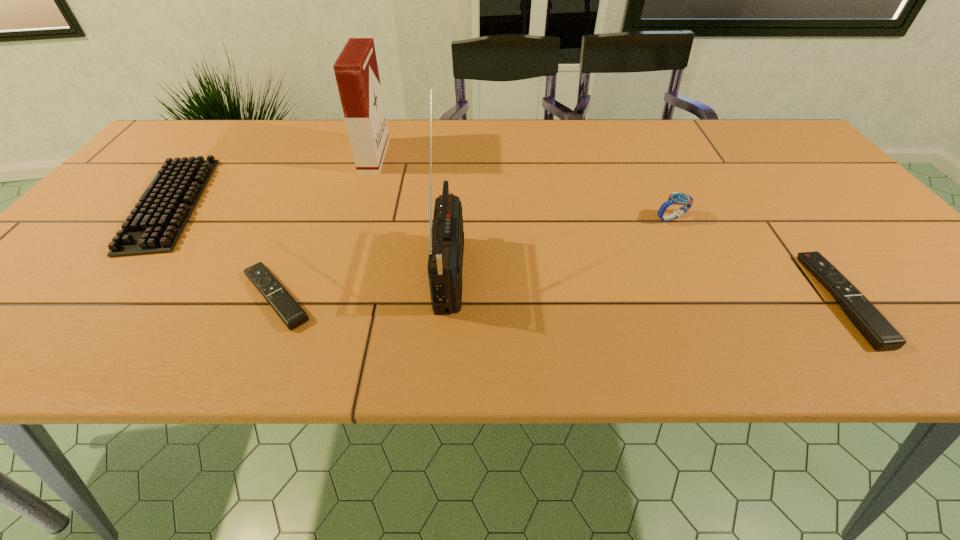
Locate an element on the screen. blank region between the leftmost object and the shortest object is located at coordinates pos(224,250).

Where is `free space that is in between the third tallest object and the shorter remote control`? Image resolution: width=960 pixels, height=540 pixels. free space that is in between the third tallest object and the shorter remote control is located at coordinates (474, 257).

You are a GUI agent. You are given a task and a screenshot of the screen. Output one action in this format:
    pyautogui.click(x=<x>, y=<y>)
    Task: Click on the empty space that is in between the fourth shortest object and the leftmost object
    The image size is (960, 540).
    Given the screenshot: What is the action you would take?
    pyautogui.click(x=421, y=211)

Where is `free area in between the fourth object from left to right and the computer keyboard`? Image resolution: width=960 pixels, height=540 pixels. free area in between the fourth object from left to right and the computer keyboard is located at coordinates (310, 236).

You are a GUI agent. You are given a task and a screenshot of the screen. Output one action in this format:
    pyautogui.click(x=<x>, y=<y>)
    Task: Click on the object identified as the second closest to the shortest object
    The width and height of the screenshot is (960, 540).
    Given the screenshot: What is the action you would take?
    pyautogui.click(x=446, y=236)

Where is `object that is the closest to the watch`? The width and height of the screenshot is (960, 540). object that is the closest to the watch is located at coordinates (877, 330).

The image size is (960, 540). I want to click on free space that satisfies the following two spatial constraints: 1. on the front-facing side of the cigarette_case; 2. on the right side of the rightmost object, so click(328, 299).

Locate an element on the screen. The height and width of the screenshot is (540, 960). vacant space that satisfies the following two spatial constraints: 1. on the back side of the left remote control; 2. on the left side of the second object from right to left is located at coordinates (310, 218).

Identify the location of vacant space that satisfies the following two spatial constraints: 1. on the front-facing side of the second tallest object; 2. on the right side of the rightmost object. (328, 299).

Find the location of a particular element. Image resolution: width=960 pixels, height=540 pixels. free point that satisfies the following two spatial constraints: 1. on the front-facing side of the fourth shortest object; 2. on the right side of the fifth shortest object is located at coordinates (354, 218).